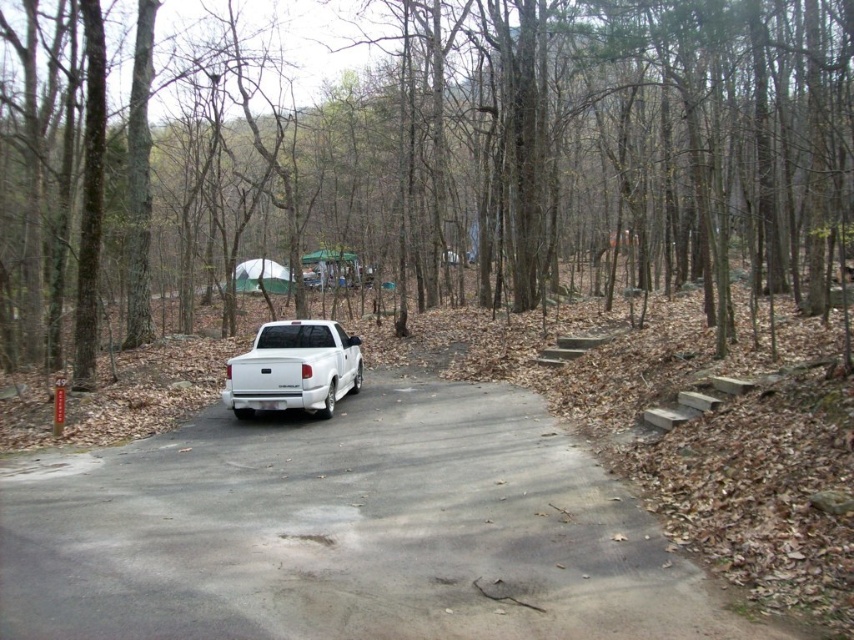
You are standing at point A, which is located at coordinates (591, 141). You want to walk towards the white pickup truck parked on the left side of the road. Is the brown rough tree at center between you and the truck?

Yes, the brown rough tree at center is located at point A, so you are standing right at the tree. Therefore, the tree is directly where you are standing, so it is between you and the truck.

You are standing at the camera position and want to take a photo of the brown rough tree at center. What are the coordinates of the tree in the image?

The coordinates of the brown rough tree at center are at point (591, 141).